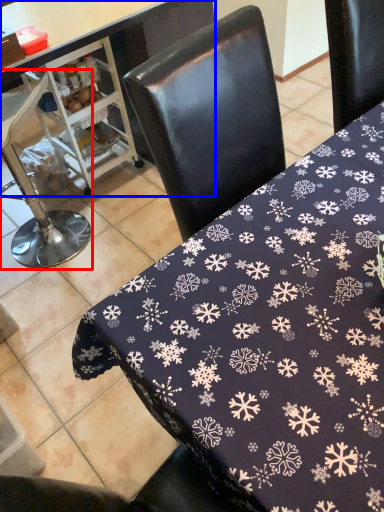
Question: Which object is closer to the camera taking this photo, chair (highlighted by a red box) or table (highlighted by a blue box)?

Choices:
 (A) chair
 (B) table

Answer: (B)